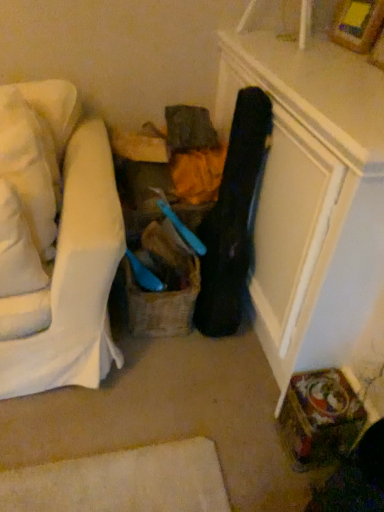
Where is `free space above burlap basket at center (from a real-world perspective)`? free space above burlap basket at center (from a real-world perspective) is located at coordinates (170, 248).